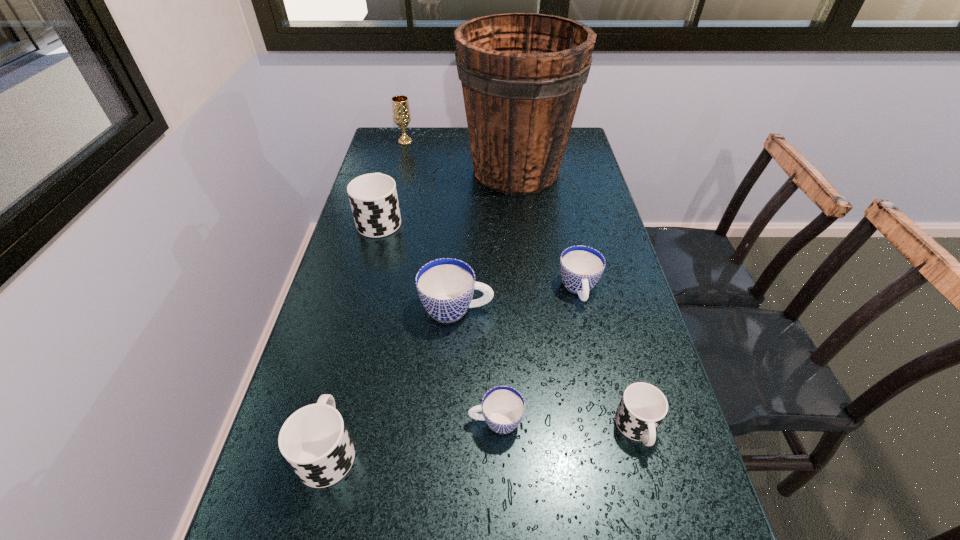
This screenshot has height=540, width=960. What are the coordinates of `object that ranks as the fourth closest to the second biggest black cup` in the screenshot? It's located at (581, 267).

Locate an element on the screen. The image size is (960, 540). object that ranks as the fifth closest to the bucket is located at coordinates (503, 407).

Where is `cup identified as the third closest to the third tallest object`? cup identified as the third closest to the third tallest object is located at coordinates (314, 440).

Find the location of `cup that is the fourth closest to the smallest black cup`. cup that is the fourth closest to the smallest black cup is located at coordinates (314, 440).

Locate an element on the screen. The width and height of the screenshot is (960, 540). black cup that is the third closest to the rightmost blue cup is located at coordinates (314, 440).

Locate an element on the screen. Image resolution: width=960 pixels, height=540 pixels. black cup that stands as the second closest to the shortest cup is located at coordinates (314, 440).

This screenshot has height=540, width=960. Identify the location of blue cup that stands as the second closest to the nearest blue cup. (581, 267).

The width and height of the screenshot is (960, 540). What are the coordinates of `blue cup that is the second closest to the bucket` in the screenshot? It's located at (445, 286).

I want to click on free location that satisfies the following two spatial constraints: 1. on the side of the second biggest blue cup with the handle; 2. on the side of the biggest blue cup with the handle, so click(x=583, y=309).

Where is `free spot that satisfies the following two spatial constraints: 1. on the front side of the bucket; 2. on the side of the shortest cup with the handle`? free spot that satisfies the following two spatial constraints: 1. on the front side of the bucket; 2. on the side of the shortest cup with the handle is located at coordinates (542, 421).